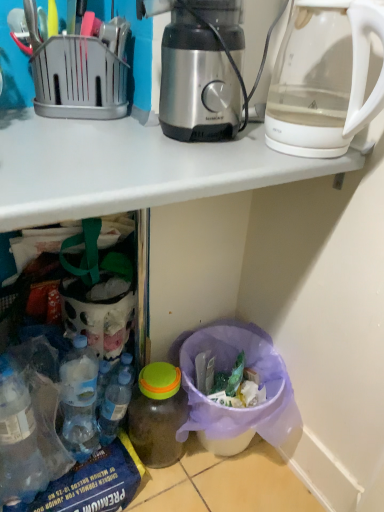
Question: Is blue translucent bottle at lower left, the second bottle positioned from the right, in front of or behind translucent plastic bottle at lower center, the second bottle when ordered from left to right, in the image?

Choices:
 (A) behind
 (B) front

Answer: (A)

Question: Is point 112,380 closer or farther from the camera than point 168,378?

Choices:
 (A) closer
 (B) farther

Answer: (B)

Question: Which of these objects is positioned closest to the blue translucent bottle at lower left, the second bottle positioned from the right?

Choices:
 (A) stainless steel coffee maker at center
 (B) translucent plastic bottle at lower center, marked as the first bottle in a right-to-left arrangement
 (C) transparent glass kettle at upper right

Answer: (B)

Question: Which object is the closest to the blue translucent bottle at lower left, the second bottle positioned from the right?

Choices:
 (A) stainless steel coffee maker at center
 (B) translucent plastic bottle at lower center, the second bottle when ordered from left to right
 (C) transparent glass kettle at upper right

Answer: (B)